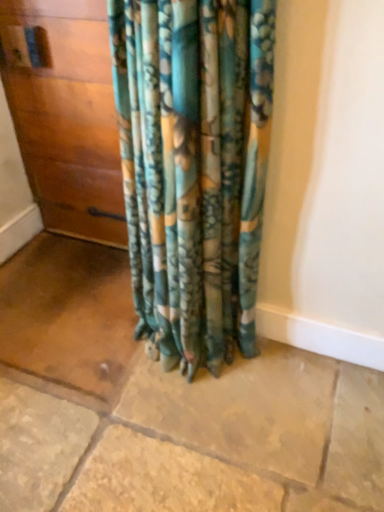
Where is `wooden door at left`? wooden door at left is located at coordinates (65, 114).

What do you see at coordinates (65, 114) in the screenshot? I see `wooden door at left` at bounding box center [65, 114].

This screenshot has height=512, width=384. Identify the location of wooden door at left. (65, 114).